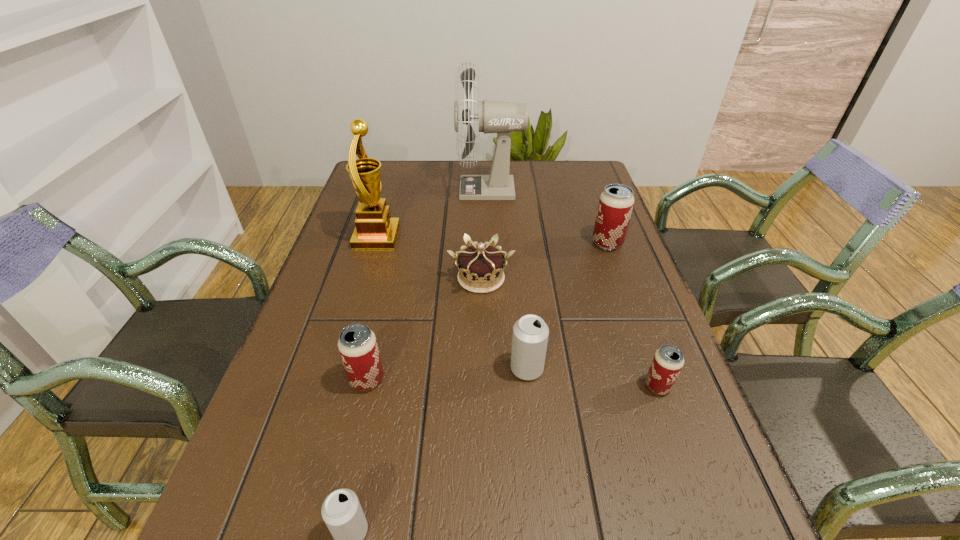
The width and height of the screenshot is (960, 540). Identify the location of vacant space that satisfies the following two spatial constraints: 1. on the back side of the smallest red beer can; 2. on the right side of the biggest red beer can. (607, 243).

Where is `free location that satisfies the following two spatial constraints: 1. on the front side of the smallest red beer can; 2. on the right side of the leftmost red beer can`? The image size is (960, 540). free location that satisfies the following two spatial constraints: 1. on the front side of the smallest red beer can; 2. on the right side of the leftmost red beer can is located at coordinates (366, 386).

The height and width of the screenshot is (540, 960). Identify the location of vacant space that satisfies the following two spatial constraints: 1. on the air flow direction of the fan; 2. on the left side of the biggest red beer can. (492, 243).

Identify the location of vacant region that satisfies the following two spatial constraints: 1. on the front side of the gold crown; 2. on the left side of the bigger white beer can. The width and height of the screenshot is (960, 540). (481, 369).

Where is `vacant space that satisfies the following two spatial constraints: 1. on the front-facing side of the award; 2. on the right side of the smallest red beer can`? vacant space that satisfies the following two spatial constraints: 1. on the front-facing side of the award; 2. on the right side of the smallest red beer can is located at coordinates (332, 386).

You are a GUI agent. You are given a task and a screenshot of the screen. Output one action in this format:
    pyautogui.click(x=<x>, y=<y>)
    Task: Click on the vacant space that satisfies the following two spatial constraints: 1. on the air flow direction of the farthest object; 2. on the left side of the right white beer can
    The height and width of the screenshot is (540, 960).
    Given the screenshot: What is the action you would take?
    pyautogui.click(x=495, y=369)

Identify the location of free space that satisfies the following two spatial constraints: 1. on the air flow direction of the gray fan; 2. on the left side of the smallest red beer can. (496, 386).